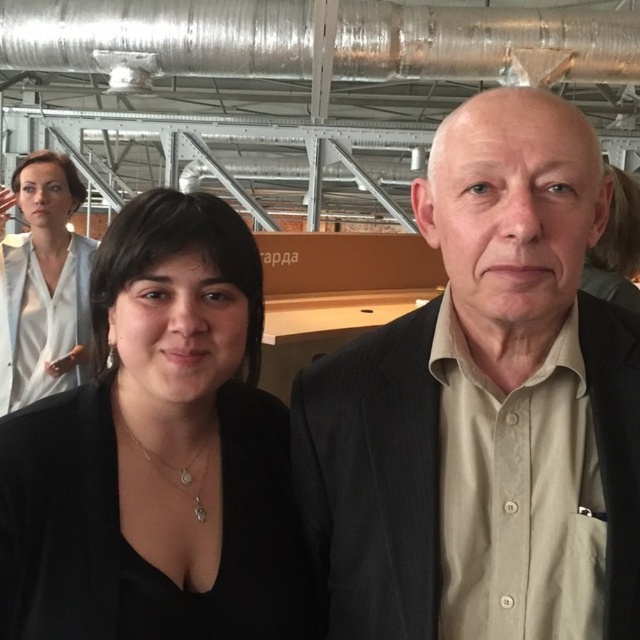
Question: Estimate the real-world distances between objects in this image. Which object is closer to the beige cotton shirt at center?

Choices:
 (A) white shirt at upper left
 (B) black matte shirt at center

Answer: (B)

Question: Is beige cotton shirt at center positioned in front of white shirt at upper left?

Choices:
 (A) no
 (B) yes

Answer: (B)

Question: Which point is closer to the camera taking this photo?

Choices:
 (A) (456, 307)
 (B) (3, 396)
 (C) (108, 529)

Answer: (C)

Question: Does black matte shirt at center have a larger size compared to white shirt at upper left?

Choices:
 (A) yes
 (B) no

Answer: (B)

Question: Is beige cotton shirt at center to the right of white shirt at upper left from the viewer's perspective?

Choices:
 (A) yes
 (B) no

Answer: (A)

Question: Among these points, which one is nearest to the camera?

Choices:
 (A) (449, 420)
 (B) (122, 593)
 (C) (84, 332)

Answer: (B)